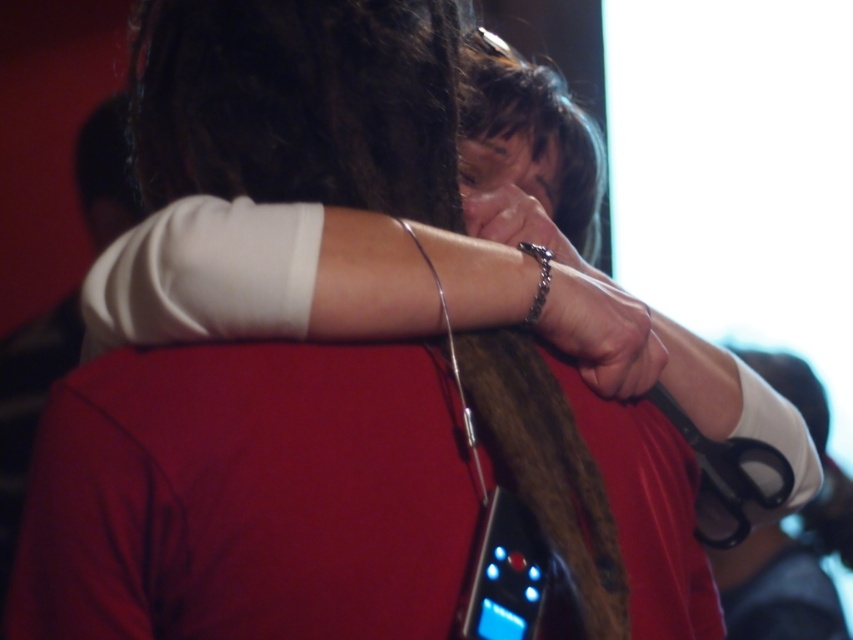
Question: Is silver chain bracelet at upper center closer to camera compared to silver metallic bracelet at upper center?

Choices:
 (A) no
 (B) yes

Answer: (B)

Question: Which point is farther from the camera taking this photo?

Choices:
 (A) (547, 340)
 (B) (148, 305)
 (C) (517, 205)

Answer: (C)

Question: Does metallic bracelet at center have a lesser width compared to silver metallic chain at upper center?

Choices:
 (A) no
 (B) yes

Answer: (A)

Question: Among these points, which one is nearest to the camera?

Choices:
 (A) (544, 273)
 (B) (570, 260)
 (C) (613, 330)

Answer: (A)

Question: Which point is closer to the camera?

Choices:
 (A) (693, 337)
 (B) (537, 212)
 (C) (532, 300)
 (D) (169, 260)

Answer: (D)

Question: Can you confirm if white matte arm at center is smaller than silver chain bracelet at upper center?

Choices:
 (A) yes
 (B) no

Answer: (A)